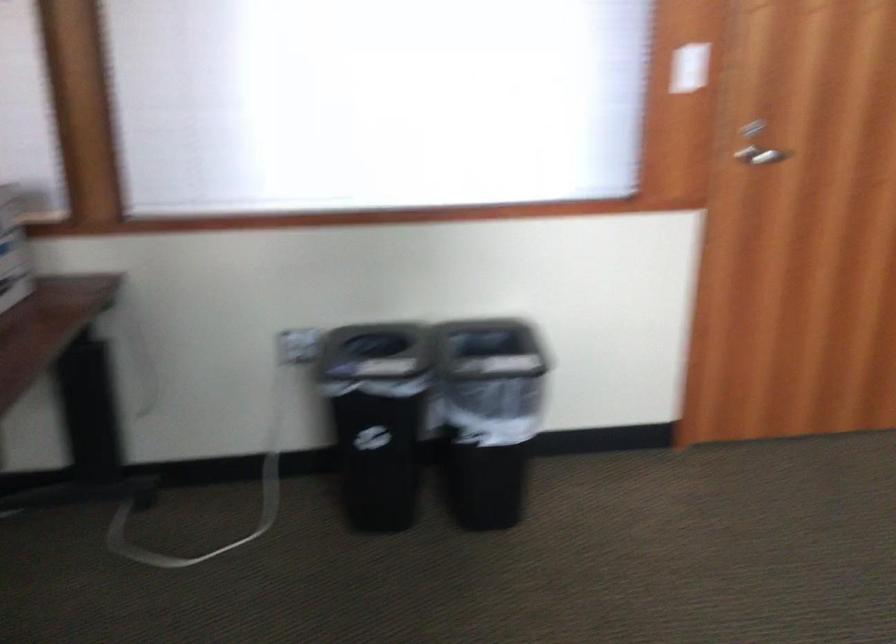
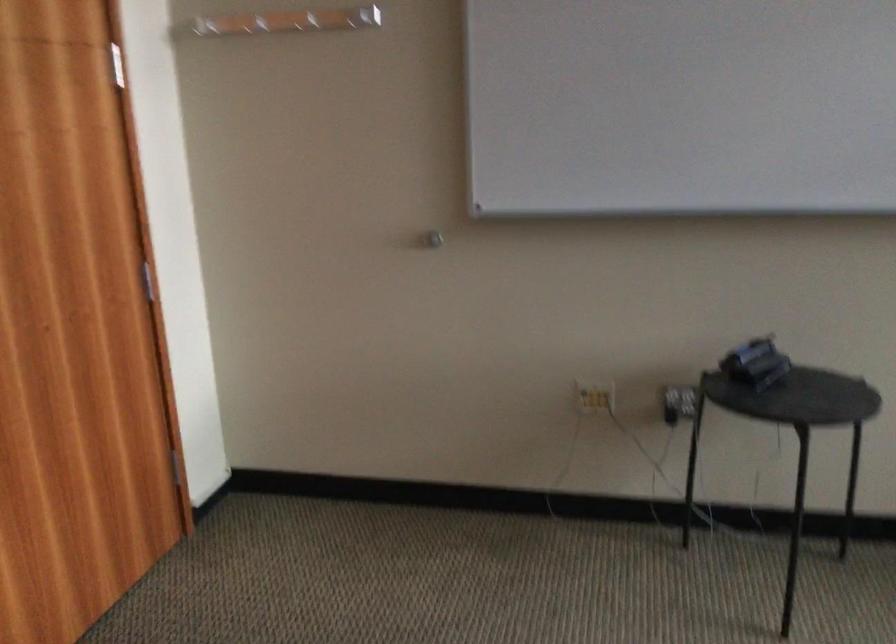
Question: The camera is either moving clockwise (left) or counter-clockwise (right) around the object. The first image is from the beginning of the video and the second image is from the end. Is the camera moving left or right when shooting the video?

Choices:
 (A) Left
 (B) Right

Answer: (A)